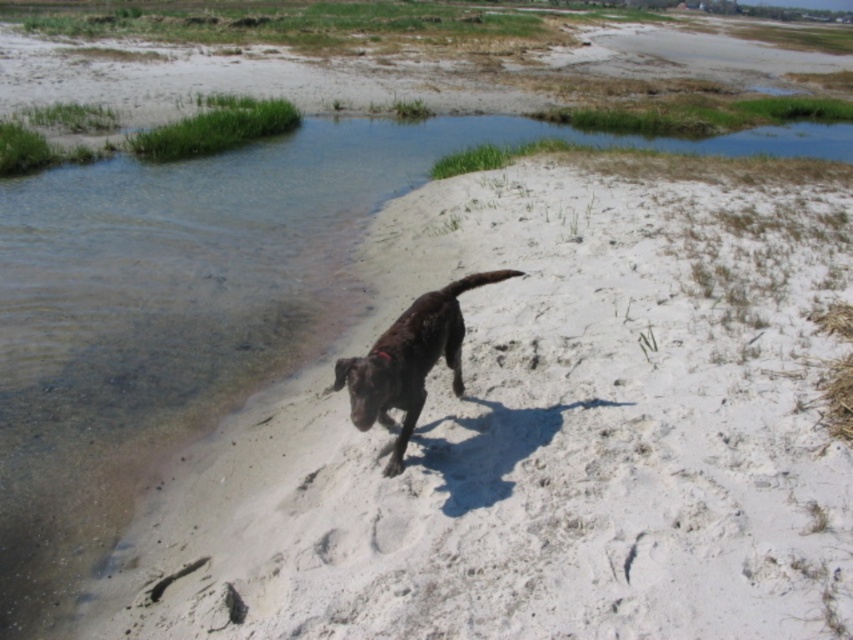
Question: Which point appears closest to the camera in this image?

Choices:
 (A) (380, 358)
 (B) (416, 227)

Answer: (A)

Question: Which object is closer to the camera taking this photo?

Choices:
 (A) white sandy beach at center
 (B) brown matte dog at center

Answer: (A)

Question: Can you confirm if white sandy beach at center is bigger than brown matte dog at center?

Choices:
 (A) yes
 (B) no

Answer: (A)

Question: Does white sandy beach at center lie behind brown matte dog at center?

Choices:
 (A) yes
 (B) no

Answer: (B)

Question: Is white sandy beach at center above brown matte dog at center?

Choices:
 (A) yes
 (B) no

Answer: (A)